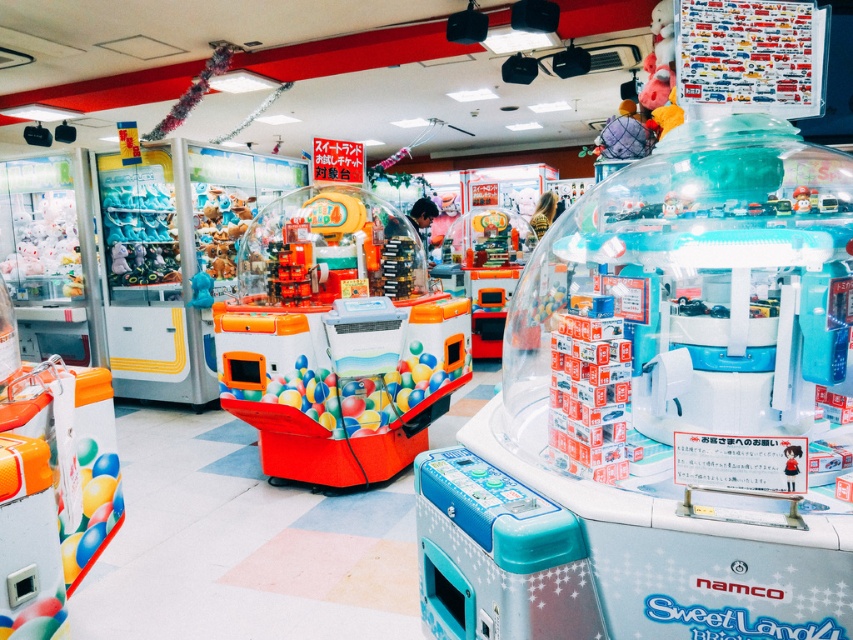
Looking at this image, which is more to the left, orange glossy claw machine at center or orange matte toy at center?

orange glossy claw machine at center is more to the left.

Does orange glossy claw machine at center have a greater width compared to orange matte toy at center?

Indeed, orange glossy claw machine at center has a greater width compared to orange matte toy at center.

Between point (323, 326) and point (616, 401), which one is positioned behind?

Point (323, 326)

Identify the location of orange glossy claw machine at center. (337, 339).